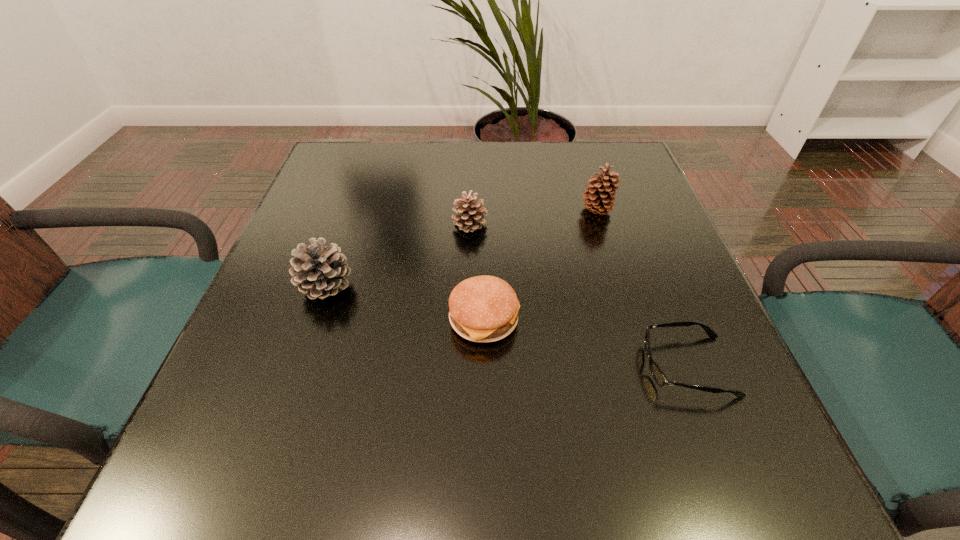
I want to click on free space at the far left corner, so click(326, 150).

In the image, there is a desktop. Identify the location of vacant space at the near left corner. The height and width of the screenshot is (540, 960). (184, 457).

In order to click on vacant area at the far right corner of the desktop in this screenshot , I will do `click(644, 173)`.

Locate an element on the screen. free spot between the spectacles and the hamburger is located at coordinates (586, 343).

The width and height of the screenshot is (960, 540). In order to click on vacant space that is in between the shortest pinecone and the shortest object in this screenshot , I will do `click(579, 295)`.

You are a GUI agent. You are given a task and a screenshot of the screen. Output one action in this format:
    pyautogui.click(x=<x>, y=<y>)
    Task: Click on the unoccupied area between the leftmost pinecone and the hamburger
    The image size is (960, 540).
    Given the screenshot: What is the action you would take?
    pyautogui.click(x=405, y=303)

The width and height of the screenshot is (960, 540). What are the coordinates of `unoccupied area between the rightmost pinecone and the leftmost pinecone` in the screenshot? It's located at (461, 248).

Identify the location of blank region between the shortest pinecone and the spectacles. (579, 295).

Where is `vacant space that's between the rightmost pinecone and the nearest pinecone`? vacant space that's between the rightmost pinecone and the nearest pinecone is located at coordinates (461, 248).

Identify the location of unoccupied position between the shortest object and the rightmost pinecone. [x=642, y=288].